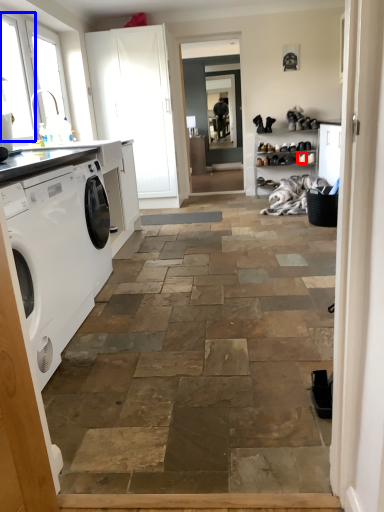
Question: Which object appears farthest to the camera in this image, shoe (highlighted by a red box) or window (highlighted by a blue box)?

Choices:
 (A) shoe
 (B) window

Answer: (A)